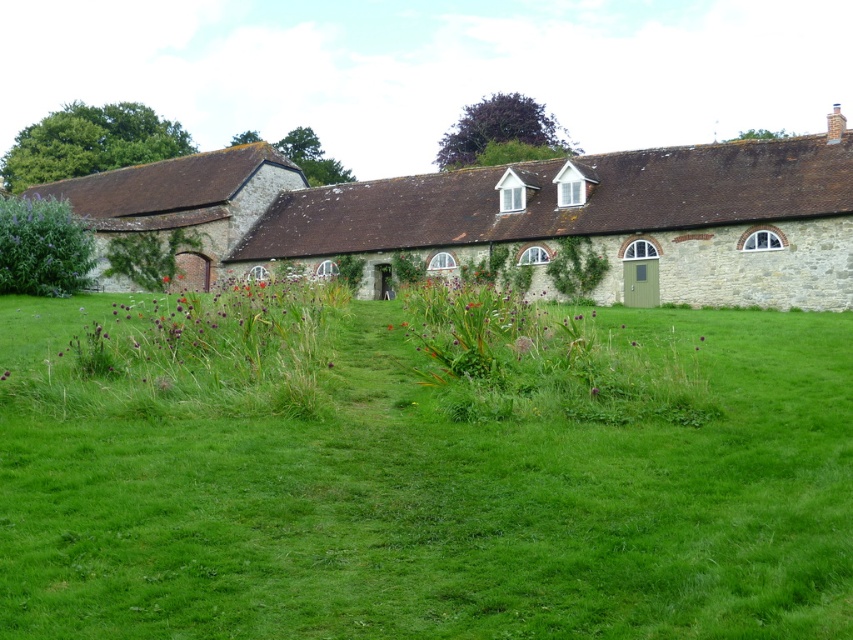
Question: Which point is farther to the camera?

Choices:
 (A) (744, 596)
 (B) (703, 339)
 (C) (363, 188)

Answer: (C)

Question: Which point appears closest to the camera in this image?

Choices:
 (A) (129, 230)
 (B) (701, 337)

Answer: (B)

Question: Is stone cottage at center bigger than purple matte flower at center?

Choices:
 (A) no
 (B) yes

Answer: (B)

Question: Among these points, which one is nearest to the camera?

Choices:
 (A) (218, 180)
 (B) (701, 339)

Answer: (B)

Question: Does green grass at center appear over stone cottage at center?

Choices:
 (A) no
 (B) yes

Answer: (A)

Question: Does brown stone cottage at left lie in front of purple matte flower at center?

Choices:
 (A) yes
 (B) no

Answer: (B)